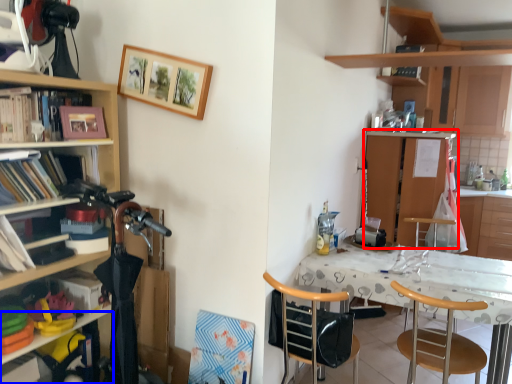
Question: Which object appears farthest to the camera in this image, cabinetry (highlighted by a red box) or shelf (highlighted by a blue box)?

Choices:
 (A) cabinetry
 (B) shelf

Answer: (A)